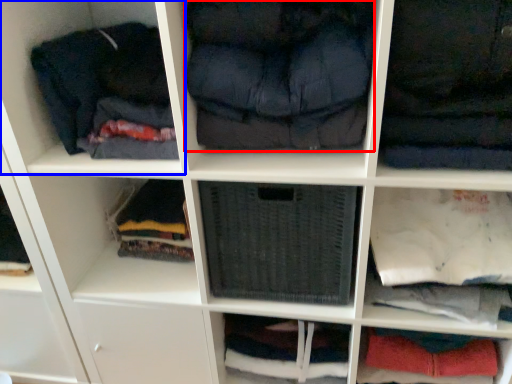
Question: Among these objects, which one is farthest to the camera, clothing (highlighted by a red box) or shelf (highlighted by a blue box)?

Choices:
 (A) clothing
 (B) shelf

Answer: (B)